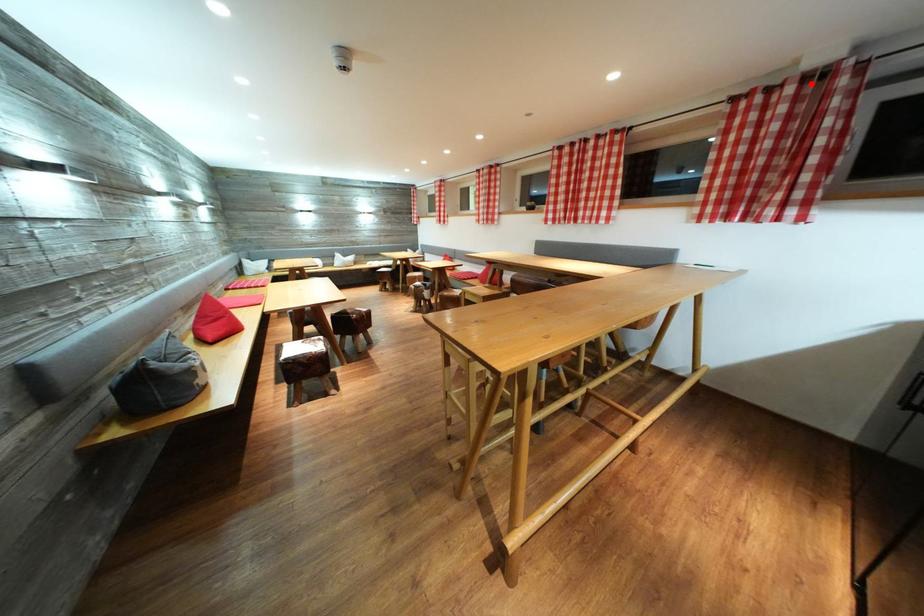
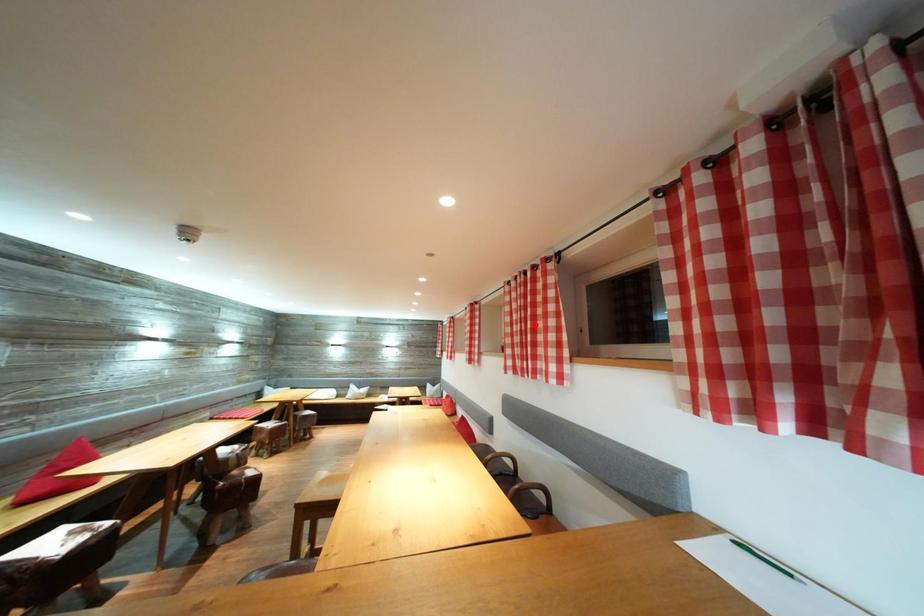
I am providing you with two images of the same scene from different viewpoints. A red point is marked on the first image and another point is marked on the second image. Does the point marked in image1 correspond to the same location as the one in image2?

No